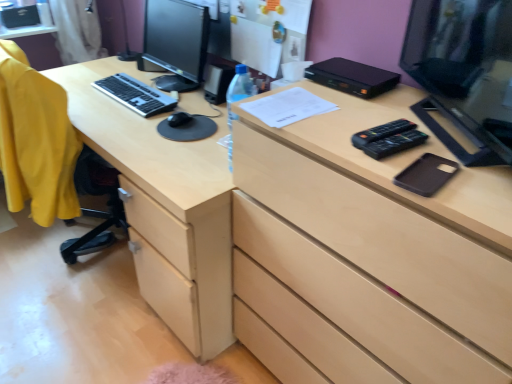
This screenshot has width=512, height=384. I want to click on vacant area that is situated to the right of black matte mouse at center, so click(x=209, y=115).